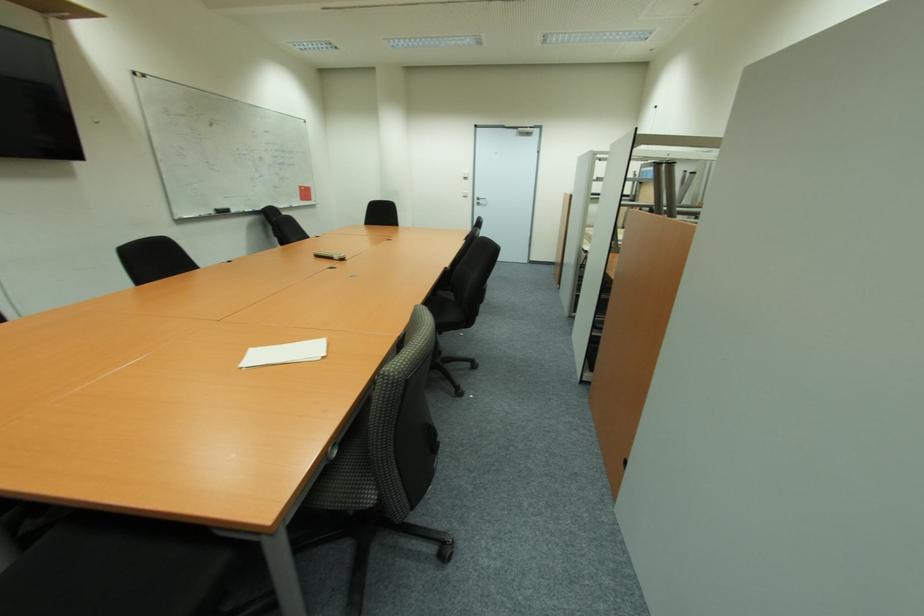
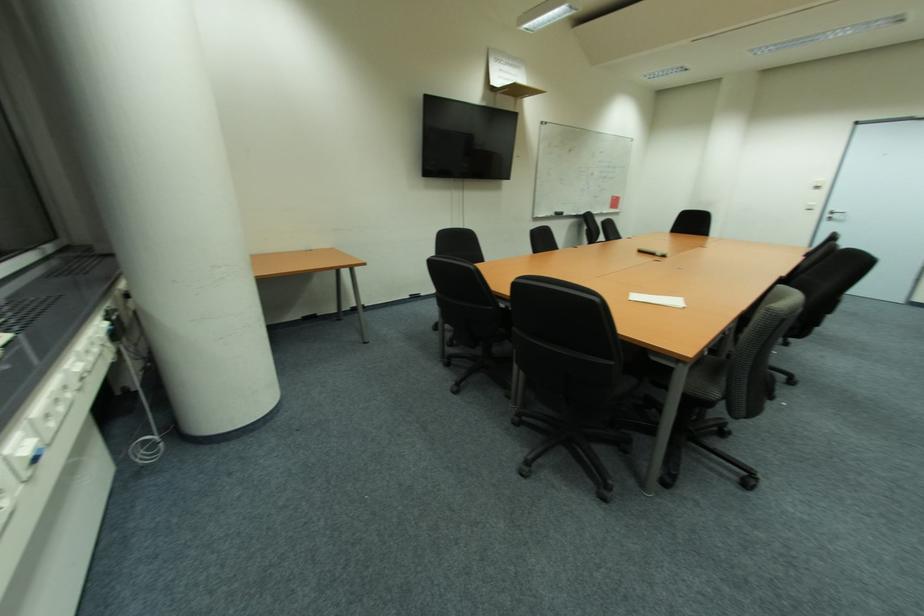
Find the pixel in the second image that matches (x=467, y=179) in the first image.

(820, 188)